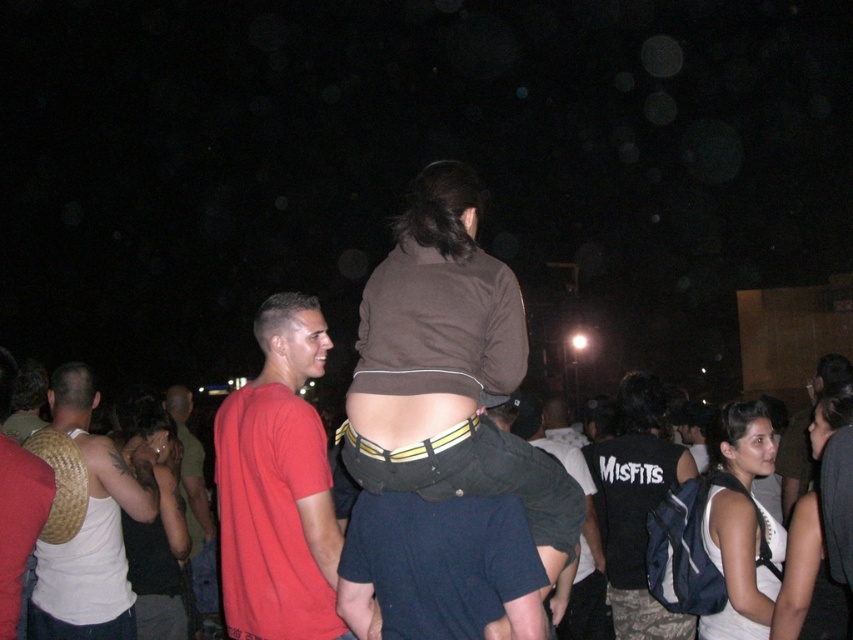
You are at a party and want to grab the matte brown wicker basket at left to serve snacks. However, you need to pass by the white matte tank top at lower right. Based on their positions, which direction should you move to reach the basket first?

The matte brown wicker basket at left is to the left of the white matte tank top at lower right, so you should move to the left to reach the basket first without going past the tank top.